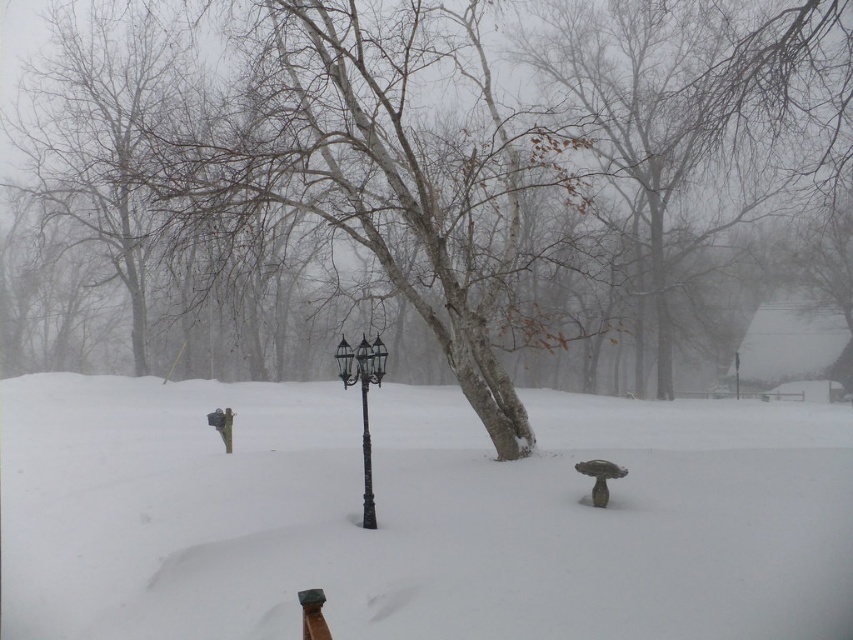
Question: Based on their relative distances, which object is farther from the black polished metal pole at center?

Choices:
 (A) black metal lamp post at center
 (B) smooth bark tree at center

Answer: (B)

Question: Is white powdery snow at center in front of black polished metal pole at center?

Choices:
 (A) yes
 (B) no

Answer: (A)

Question: Which object is farther from the camera taking this photo?

Choices:
 (A) white powdery snow at center
 (B) smooth bark tree at center

Answer: (B)

Question: Can you confirm if smooth bark tree at center is positioned to the right of black polished metal pole at center?

Choices:
 (A) yes
 (B) no

Answer: (B)

Question: Can you confirm if white powdery snow at center is bigger than black polished metal pole at center?

Choices:
 (A) yes
 (B) no

Answer: (A)

Question: Considering the real-world distances, which object is farthest from the white powdery snow at center?

Choices:
 (A) black metal lamp post at center
 (B) smooth bark tree at center
 (C) black polished metal pole at center

Answer: (C)